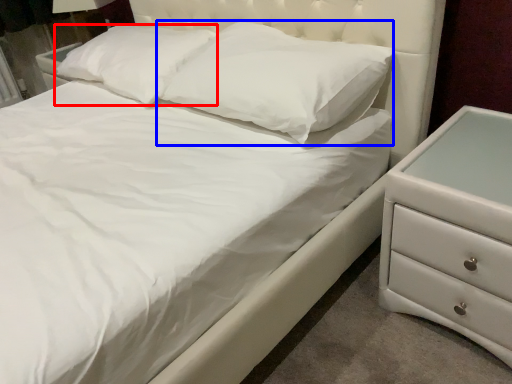
Question: Which object appears closest to the camera in this image, pillow (highlighted by a red box) or pillow (highlighted by a blue box)?

Choices:
 (A) pillow
 (B) pillow

Answer: (B)